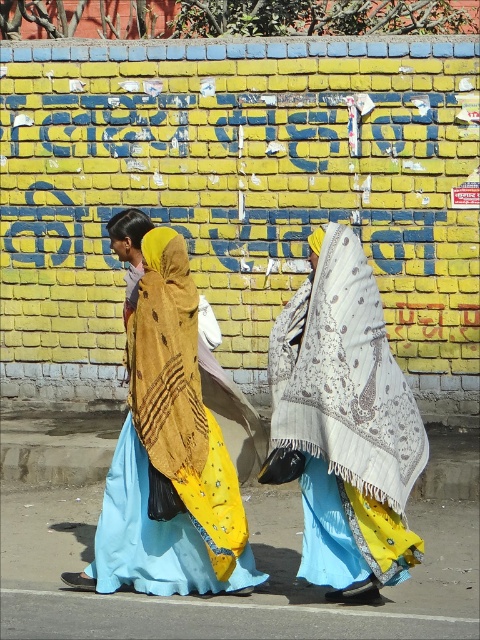
Question: Is yellow fabric shawl at center thinner than brown textured shawl at center?

Choices:
 (A) yes
 (B) no

Answer: (B)

Question: Considering the real-world distances, which object is farthest from the brown textured shawl at center?

Choices:
 (A) white textured shawl at center
 (B) yellow fabric shawl at center

Answer: (A)

Question: Does yellow fabric shawl at center appear on the left side of brown textured shawl at center?

Choices:
 (A) no
 (B) yes

Answer: (B)

Question: Estimate the real-world distances between objects in this image. Which object is closer to the brown textured shawl at center?

Choices:
 (A) yellow fabric shawl at center
 (B) white textured shawl at center

Answer: (A)

Question: Is yellow fabric shawl at center to the left of brown textured shawl at center from the viewer's perspective?

Choices:
 (A) no
 (B) yes

Answer: (B)

Question: Which object is closer to the camera taking this photo?

Choices:
 (A) white textured shawl at center
 (B) brown textured shawl at center
 (C) yellow fabric shawl at center

Answer: (A)